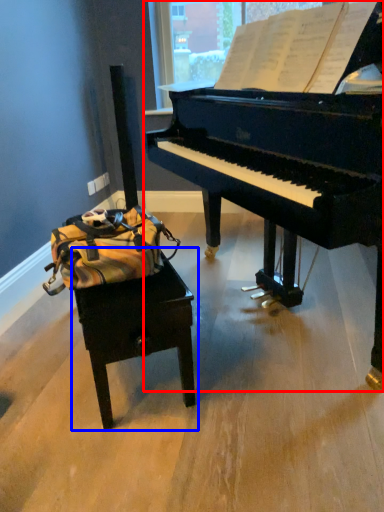
Question: Among these objects, which one is nearest to the camera, piano (highlighted by a red box) or table (highlighted by a blue box)?

Choices:
 (A) piano
 (B) table

Answer: (A)